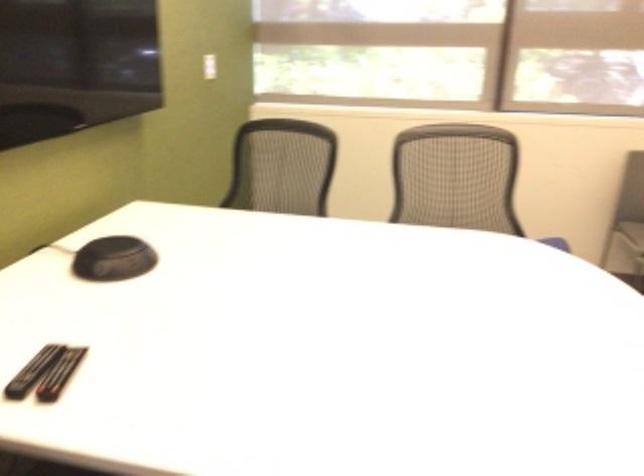
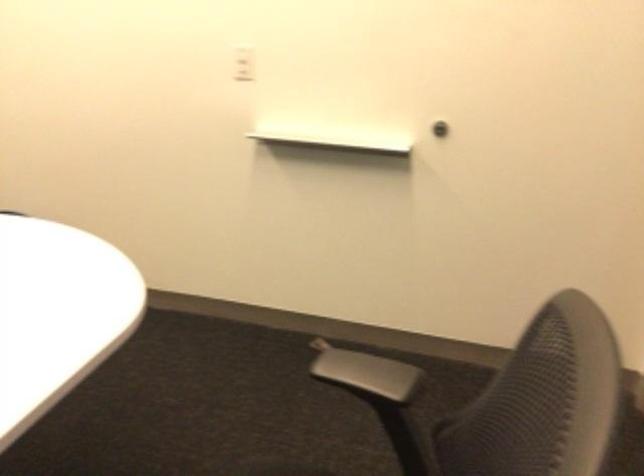
How did the camera likely rotate?

The rotation direction of the camera is right-down.